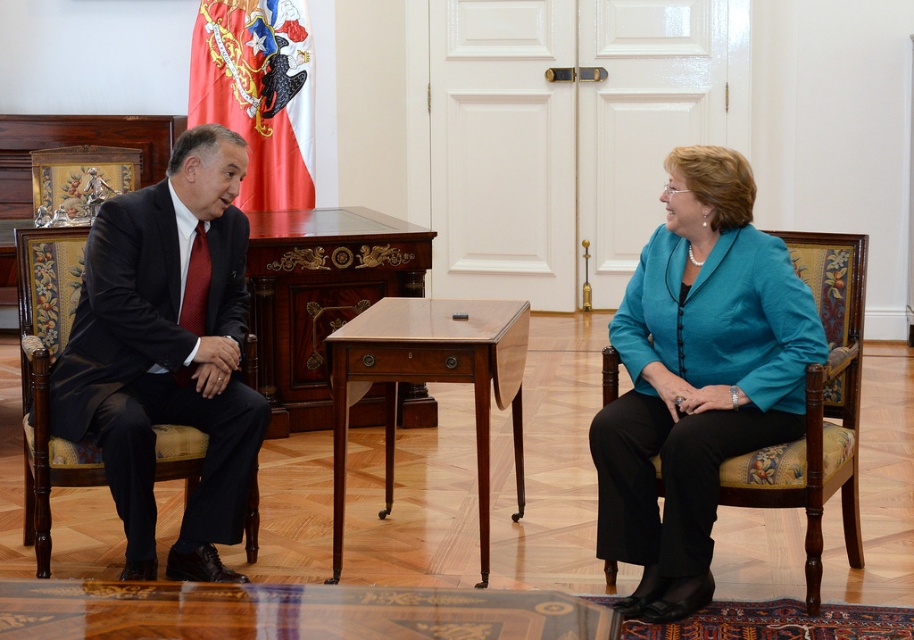
You are standing in the room and want to locate the matte black suit at left. Based on the coordinates provided, where would you find it in relation to the center of the image?

The matte black suit at left is located at coordinates point (x=149, y=378), which places it slightly to the right and above the center of the image.

From the picture: You are an interior designer assessing the seating arrangement in this formal meeting room. You notice the teal fabric jacket at center and the matte black suit at left. Which object occupies a wider space in the scene?

The teal fabric jacket at center is wider than the matte black suit at left, so it occupies a wider space in the scene.

You are an interior designer planning to place a 1.2 meter wide decorative panel between the teal fabric jacket at center and the mahogany wood table at center. Considering their widths, will the panel fit between them?

The teal fabric jacket at center is wider than the mahogany wood table at center. Since the panel is 1.2 meters wide, it may not fit if the space between them is narrower than the panel. However, the exact distance isn